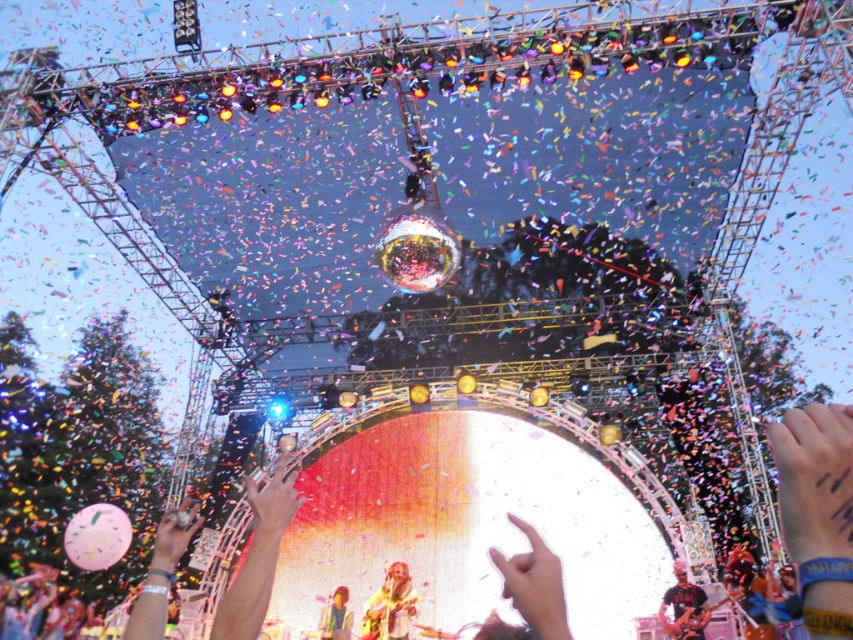
Can you confirm if yellow fabric hand at center is smaller than matte silver ring at lower left?

No.

Is point (165, 588) farther from camera compared to point (178, 528)?

No, it is not.

Image resolution: width=853 pixels, height=640 pixels. I want to click on yellow fabric hand at center, so click(x=817, y=509).

Where is `yellow fabric hand at center`? The image size is (853, 640). yellow fabric hand at center is located at coordinates (817, 509).

Who is positioned more to the left, matte black hand at center or smooth skin person at center?

From the viewer's perspective, matte black hand at center appears more on the left side.

Does matte black hand at center have a larger size compared to smooth skin person at center?

Yes.

Identify the location of matte black hand at center. (273, 502).

At what (x,y) coordinates should I click in order to perform the action: click on yellow fabric hand at center. Please return your answer as a coordinate pair (x, y). This screenshot has height=640, width=853. Looking at the image, I should click on (817, 509).

Which is more to the left, yellow fabric hand at center or matte black shirt at lower right?

yellow fabric hand at center

Which is behind, point (824, 612) or point (688, 634)?

The point (688, 634) is more distant.

You are a GUI agent. You are given a task and a screenshot of the screen. Output one action in this format:
    pyautogui.click(x=<x>, y=<y>)
    Task: Click on the yellow fabric hand at center
    This screenshot has height=640, width=853.
    Given the screenshot: What is the action you would take?
    pyautogui.click(x=817, y=509)